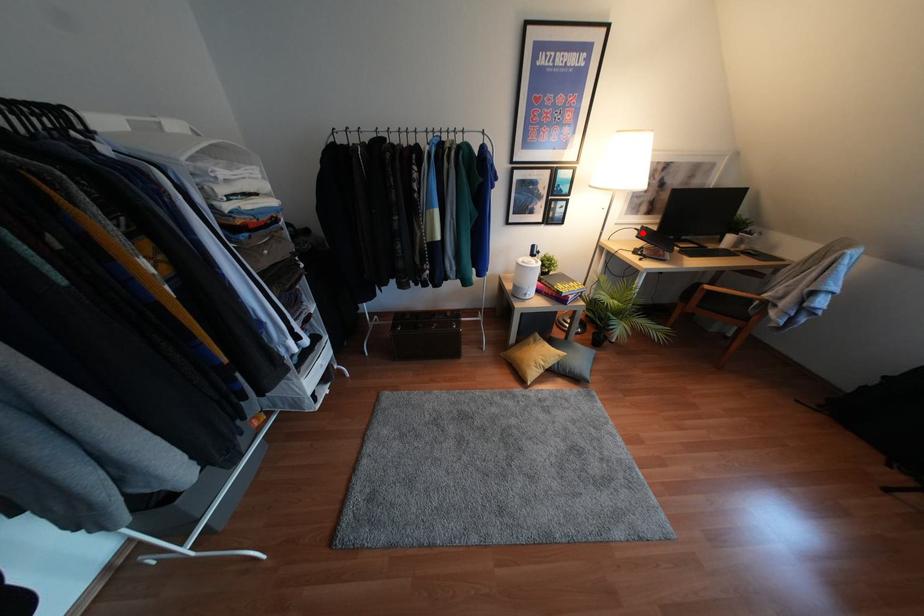
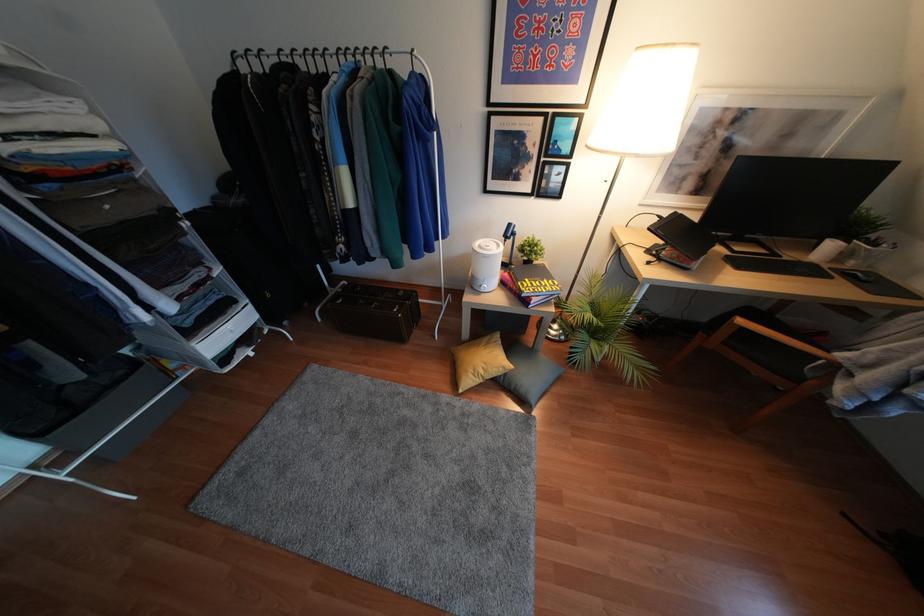
Where in the second image is the point corresponding to the highlighted location from the first image?

(666, 224)